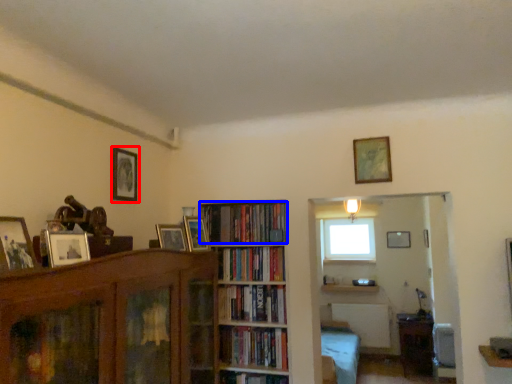
Question: Which object is further to the camera taking this photo, picture frame (highlighted by a red box) or book (highlighted by a blue box)?

Choices:
 (A) picture frame
 (B) book

Answer: (B)